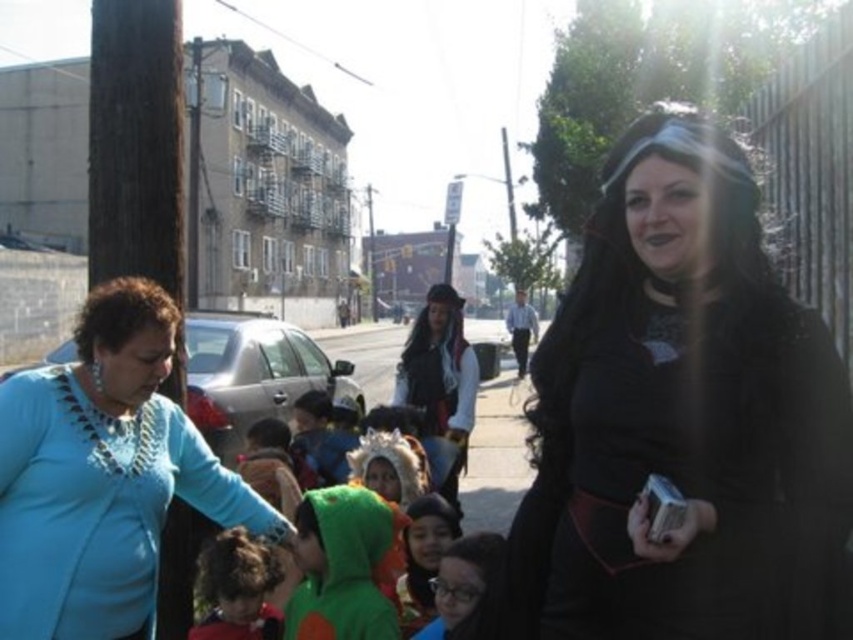
You are standing in the street scene and want to take a photo of the black matte dress at center and the velvet pirate costume at center. Which one should you focus on first to ensure both are in focus?

You should focus on the black matte dress at center first since it is closer to the viewer than the velvet pirate costume at center, allowing the camera to adjust focus for both objects.

You are standing at the point with coordinates point (4, 492) and want to move to the point with coordinates point (393, 637). Which direction should you move to reach your destination?

To move from point (4, 492) to point (393, 637), you should move towards the right and upwards since point (393, 637) is located to the right and above point (4, 492).